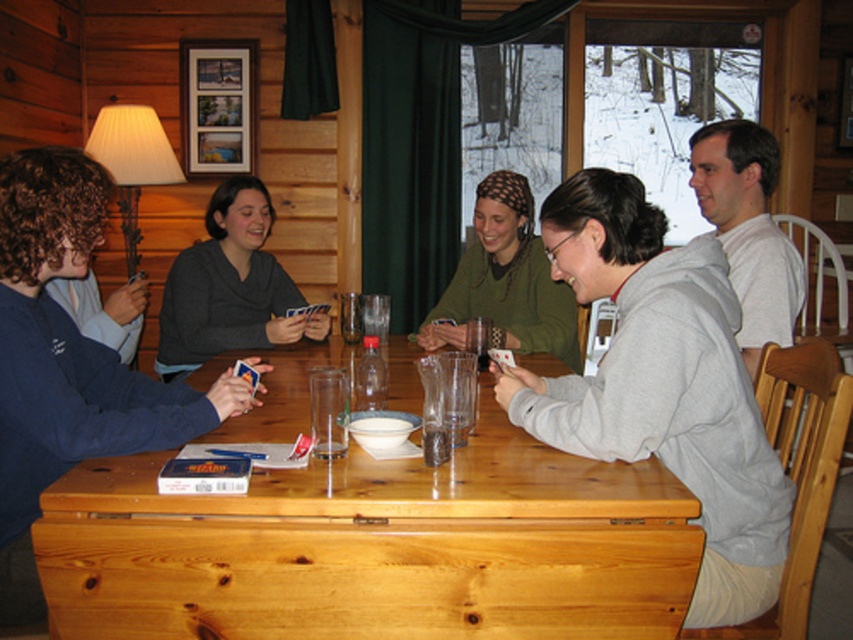
In the scene shown: You are standing in front of the table and want to place a small object on the table. You have two options for placement based on coordinates given as points. The points are point [421,481] and point [178,260]. Which point is closer to you?

Point [421,481] is closer to the camera than point [178,260], so placing the object there would be closer to you.

You are sitting at the light brown wood table at center and want to reach the translucent glass at table center. Is the glass within your immediate reach without moving your body?

The light brown wood table at center is closer to the viewer than the translucent glass at table center, so the glass is farther away. You would need to extend your arm further to reach it, but it is still on the table, so it should be reachable without moving your body.

You are a photographer setting up a camera to capture the scene. You need to ensure that both the gray sweatshirt at center and the white cotton shirt at upper right are fully visible in the frame. Based on their positions and sizes, which object might require you to adjust the camera angle to ensure it fits within the shot?

The gray sweatshirt at center might require adjusting the camera angle because it might be wider than the white cotton shirt at upper right, so ensuring it fits within the frame may need a wider angle or repositioning.